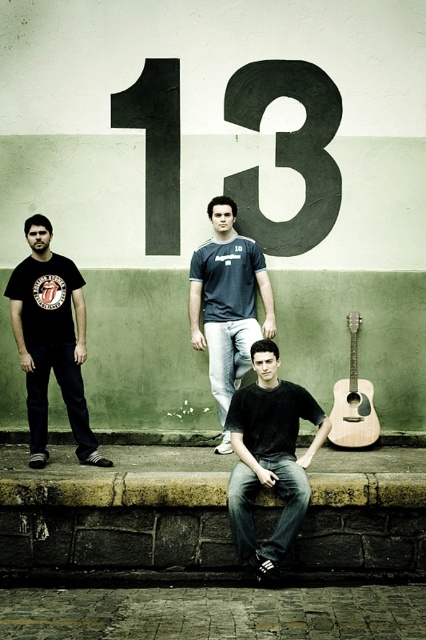
Based on the photo, you are a photographer trying to capture the black cotton shirt at center in the image. The camera is set to focus at the point with coordinates point (270,458). Will this point ensure the black cotton shirt at center is in focus?

The point (270,458) indicates the black cotton shirt at center, so yes, focusing at this point will ensure the black cotton shirt at center is in focus.

You are standing in front of the wall with the number 13. There is a brown stone ledge at lower center. Can you determine if the point marked at coordinates (118, 490) is located on the brown stone ledge at lower center?

The point (118, 490) marks the brown stone ledge at lower center, so yes, the point is located on the brown stone ledge at lower center.